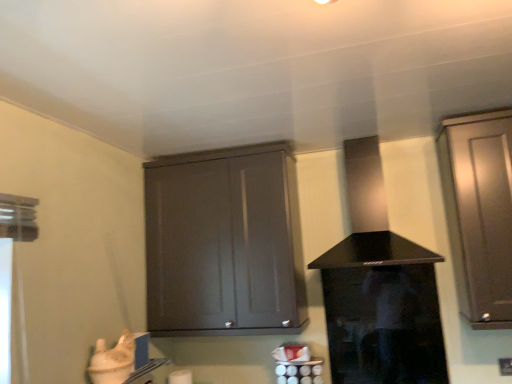
Question: Does satin brown cabinet at right, the second cabinetry in the left-to-right sequence, have a smaller size compared to transparent glass screen door at center?

Choices:
 (A) no
 (B) yes

Answer: (A)

Question: Is satin brown cabinet at right, the second cabinetry in the left-to-right sequence, at the left side of transparent glass screen door at center?

Choices:
 (A) yes
 (B) no

Answer: (B)

Question: Is satin brown cabinet at right, the second cabinetry in the left-to-right sequence, taller than transparent glass screen door at center?

Choices:
 (A) no
 (B) yes

Answer: (B)

Question: From a real-world perspective, is satin brown cabinet at right, the second cabinetry in the left-to-right sequence, positioned under transparent glass screen door at center based on gravity?

Choices:
 (A) no
 (B) yes

Answer: (A)

Question: Could you tell me if satin brown cabinet at right, placed as the first cabinetry when sorted from right to left, is turned towards transparent glass screen door at center?

Choices:
 (A) no
 (B) yes

Answer: (A)

Question: Does satin brown cabinet at right, placed as the first cabinetry when sorted from right to left, appear on the right side of transparent glass screen door at center?

Choices:
 (A) no
 (B) yes

Answer: (B)

Question: Would you say black glass vent at center is outside satin brown cabinet at right, placed as the first cabinetry when sorted from right to left?

Choices:
 (A) no
 (B) yes

Answer: (B)

Question: Considering the relative sizes of black glass vent at center and satin brown cabinet at right, the second cabinetry in the left-to-right sequence, in the image provided, is black glass vent at center shorter than satin brown cabinet at right, the second cabinetry in the left-to-right sequence,?

Choices:
 (A) no
 (B) yes

Answer: (B)

Question: Is black glass vent at center further to the viewer compared to satin brown cabinet at right, placed as the first cabinetry when sorted from right to left?

Choices:
 (A) no
 (B) yes

Answer: (B)

Question: From a real-world perspective, is black glass vent at center over satin brown cabinet at right, the second cabinetry in the left-to-right sequence?

Choices:
 (A) yes
 (B) no

Answer: (A)

Question: Is black glass vent at center smaller than satin brown cabinet at right, the second cabinetry in the left-to-right sequence?

Choices:
 (A) no
 (B) yes

Answer: (A)

Question: Is black glass vent at center far away from satin brown cabinet at right, placed as the first cabinetry when sorted from right to left?

Choices:
 (A) no
 (B) yes

Answer: (A)

Question: From the image's perspective, is matte gray cabinet at center, which appears as the first cabinetry when viewed from the left, below black glass vent at center?

Choices:
 (A) no
 (B) yes

Answer: (B)